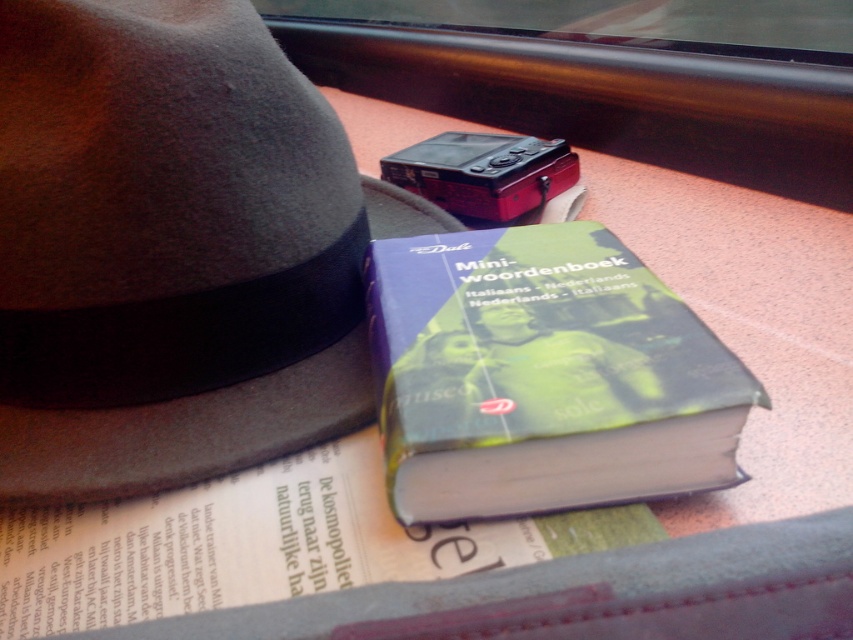
Is gray felt fedora at upper left positioned behind hardcover book at center?

Yes, it is.

Locate an element on the screen. gray felt fedora at upper left is located at coordinates (173, 250).